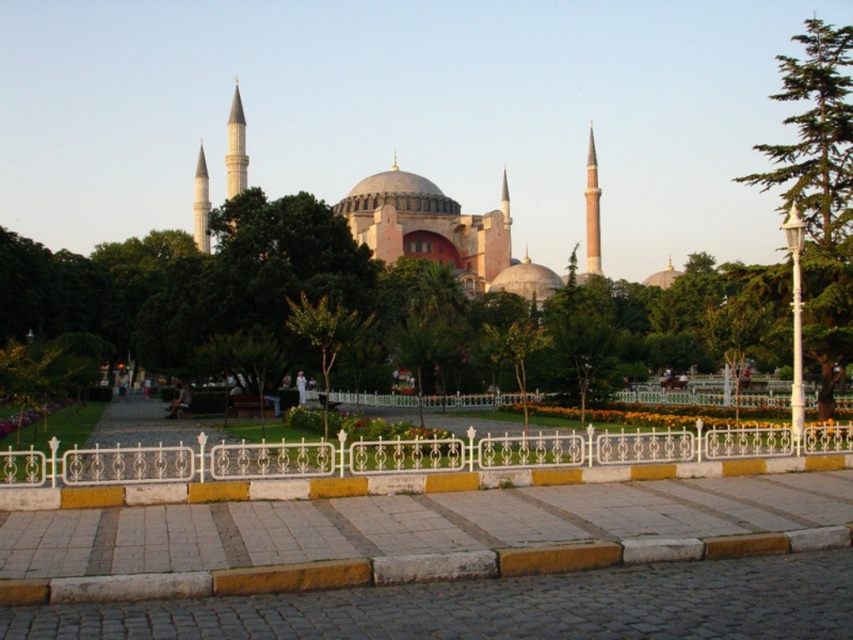
Is point (51, 476) positioned after point (850, 172)?

That is False.

Does white wrought iron fence at center have a lesser height compared to green leafy tree at right?

Correct, white wrought iron fence at center is not as tall as green leafy tree at right.

The image size is (853, 640). Describe the element at coordinates (381, 456) in the screenshot. I see `white wrought iron fence at center` at that location.

Identify the location of white wrought iron fence at center. (381, 456).